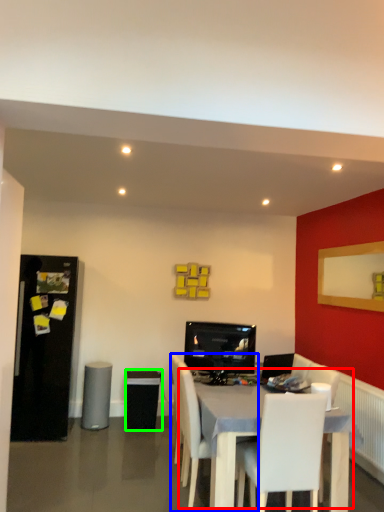
Question: Which object is the farthest from table (highlighted by a red box)? Choose among these: chair (highlighted by a blue box) or speaker (highlighted by a green box).

Choices:
 (A) chair
 (B) speaker

Answer: (B)